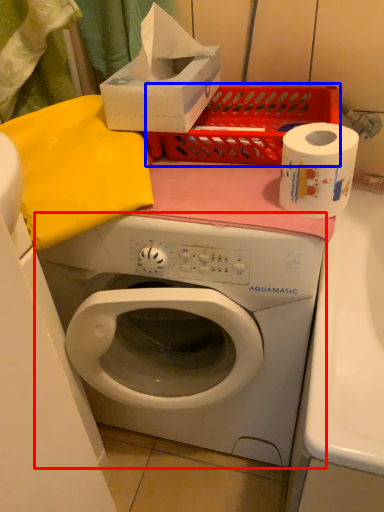
Question: Which point is further to the camera, washing machine (highlighted by a red box) or crate (highlighted by a blue box)?

Choices:
 (A) washing machine
 (B) crate

Answer: (B)